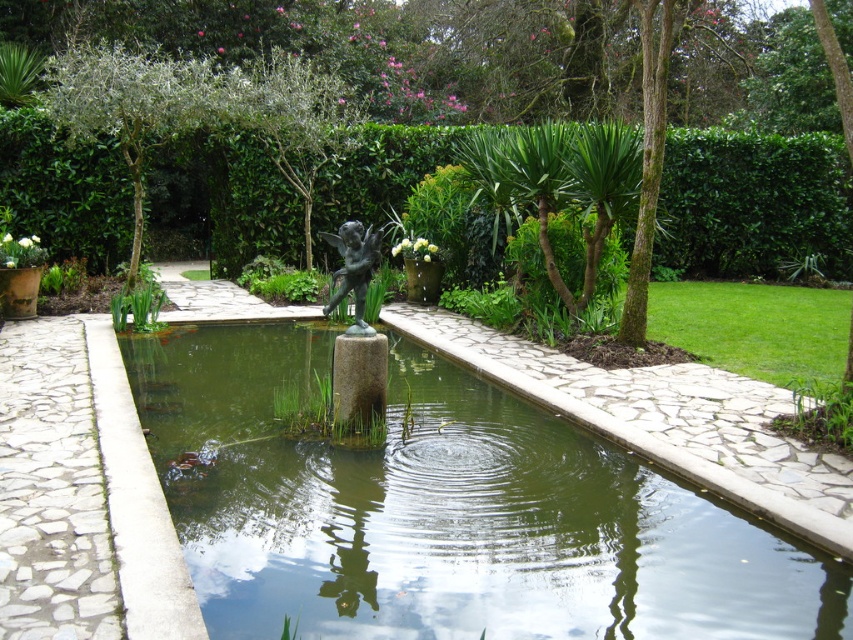
Who is lower down, green stone pond at center or bronze statue at center?

green stone pond at center

Who is positioned more to the right, green stone pond at center or bronze statue at center?

Positioned to the right is green stone pond at center.

Locate an element on the screen. The width and height of the screenshot is (853, 640). green stone pond at center is located at coordinates (444, 509).